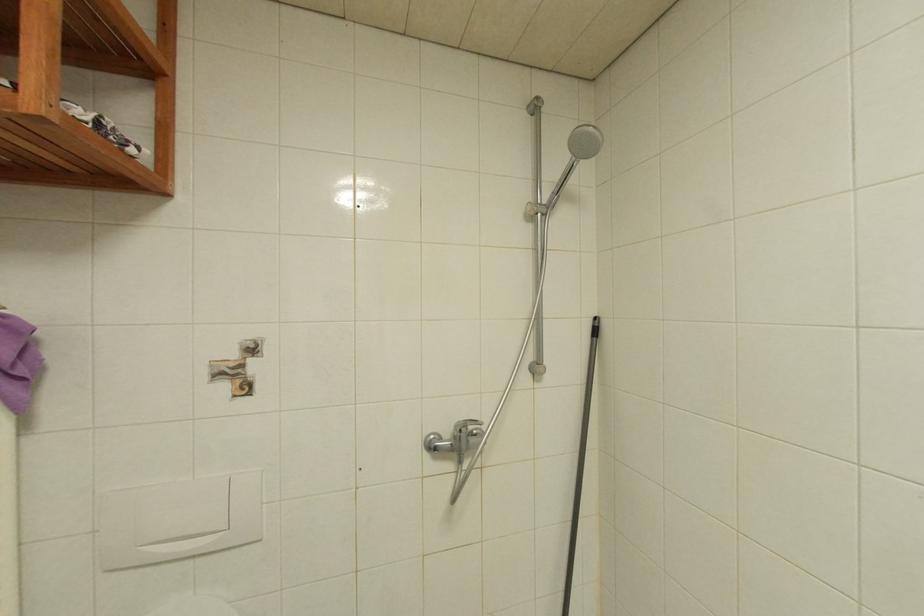
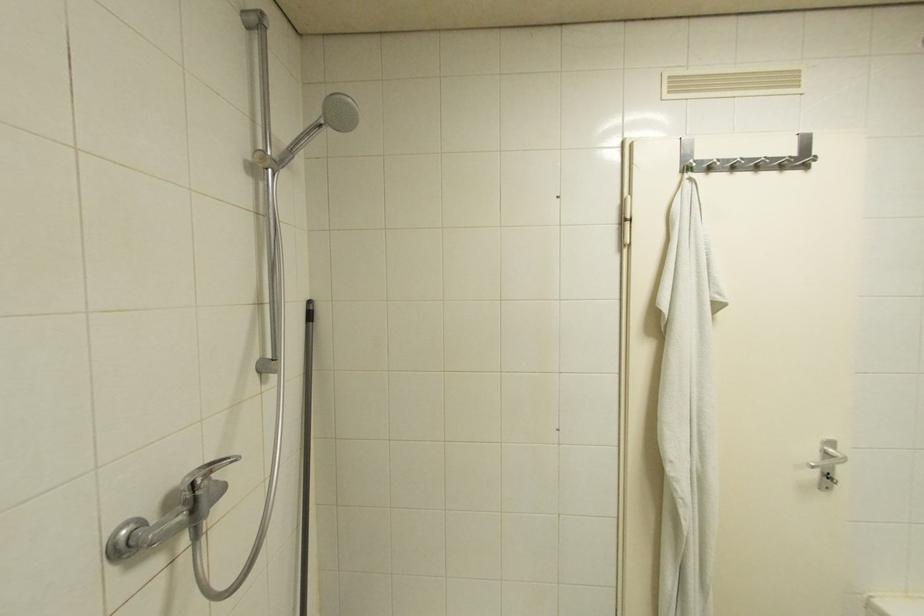
Question: The images are taken continuously from a first-person perspective. In which direction is your viewpoint rotating?

Choices:
 (A) Left
 (B) Right
 (C) Up
 (D) Down

Answer: (B)